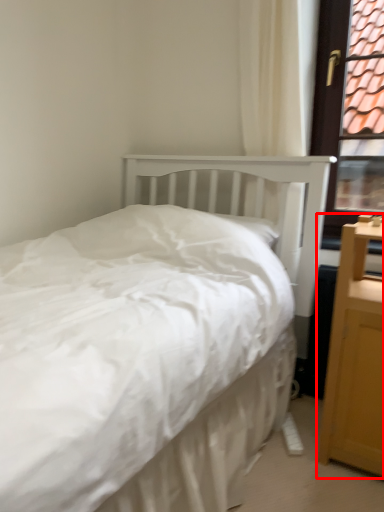
Question: Where is nightstand (annotated by the red box) located in relation to window frame in the image?

Choices:
 (A) right
 (B) left

Answer: (B)